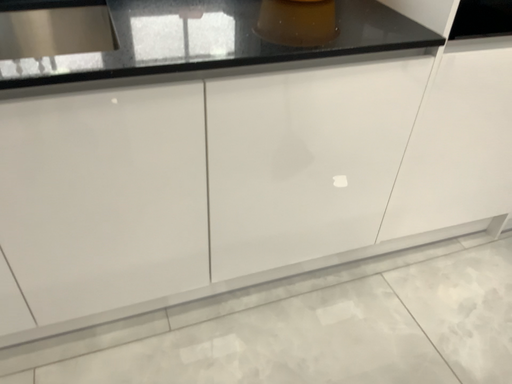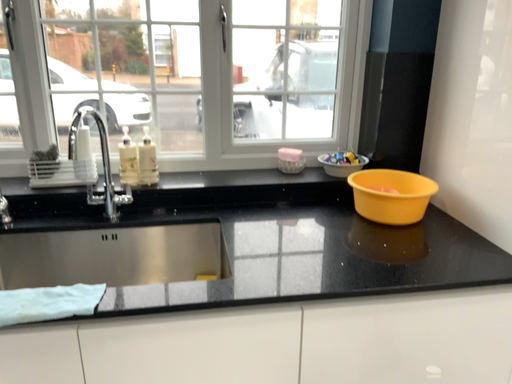
Question: Which way did the camera rotate in the video?

Choices:
 (A) rotated right
 (B) rotated left

Answer: (B)